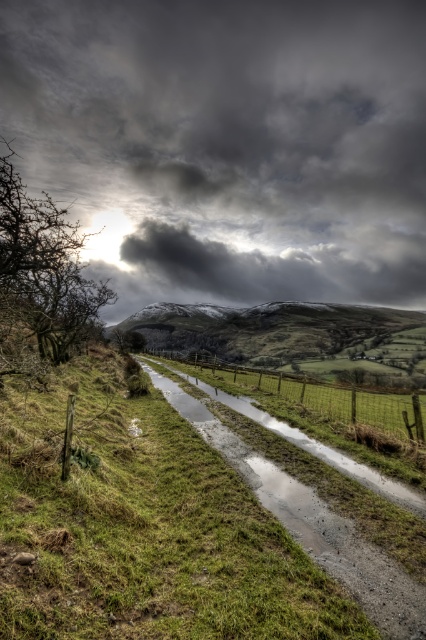
You are a hiker planning to cross the gray gravel stream at center. You notice the dark gray cloud at upper center in the sky. Based on the scene, which object is higher in elevation?

The dark gray cloud at upper center is higher in elevation than the gray gravel stream at center because it is taller.

You are standing at the muddy path in the scene and want to walk towards the point that is closer to you. Which point should you head towards, point (417,44) or point (365,408)?

Point (365,408) is closer to you than point (417,44), so you should head towards point (365,408).